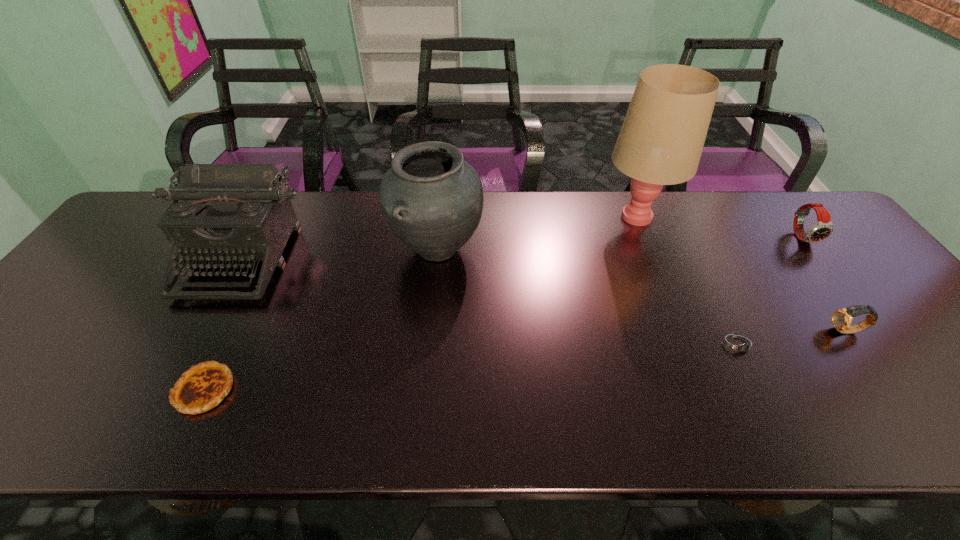
Identify which watch is located as the nearest to the shortest object. Please provide its 2D coordinates. Your answer should be formatted as a tuple, i.e. [(x, y)], where the tuple contains the x and y coordinates of a point satisfying the conditions above.

[(841, 319)]

The height and width of the screenshot is (540, 960). I want to click on watch that stands as the second closest to the fifth object from right to left, so click(x=841, y=319).

At what (x,y) coordinates should I click in order to perform the action: click on vacant space that satisfies the following two spatial constraints: 1. on the typing side of the nearest object; 2. on the right side of the typewriter. Please return your answer as a coordinate pair (x, y). The width and height of the screenshot is (960, 540). Looking at the image, I should click on (167, 390).

You are a GUI agent. You are given a task and a screenshot of the screen. Output one action in this format:
    pyautogui.click(x=<x>, y=<y>)
    Task: Click on the free space that satisfies the following two spatial constraints: 1. on the face of the second shortest watch; 2. on the face of the shortest object
    The height and width of the screenshot is (540, 960).
    Given the screenshot: What is the action you would take?
    pyautogui.click(x=855, y=345)